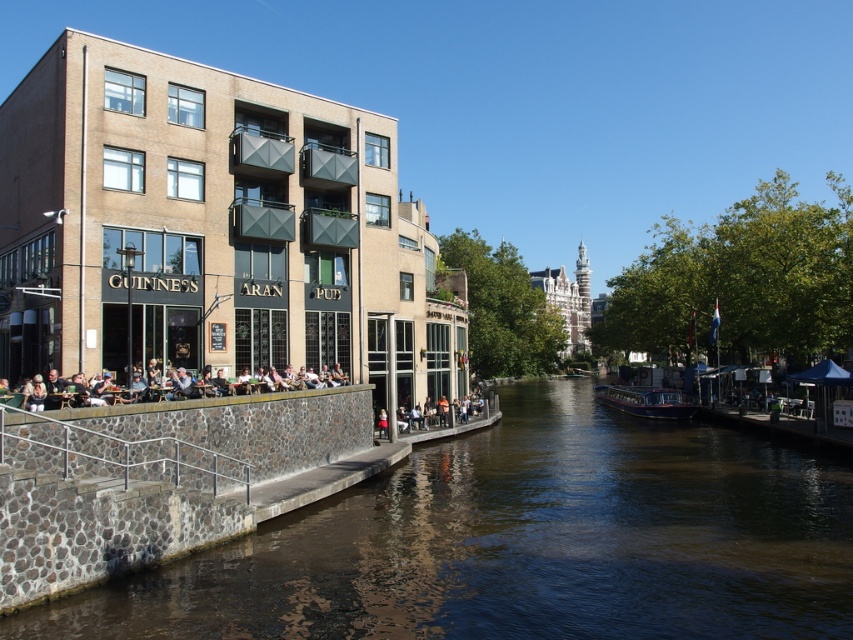
Question: From the image, what is the correct spatial relationship of matte black chairs at left in relation to dark blue polished wood boat at center?

Choices:
 (A) above
 (B) below

Answer: (A)

Question: Among these objects, which one is nearest to the camera?

Choices:
 (A) matte black chairs at left
 (B) dark blue polished wood boat at center
 (C) stainless steel railing at lower left
 (D) brown stone river at center

Answer: (D)

Question: Can you confirm if brown stone river at center is positioned below matte black chairs at left?

Choices:
 (A) yes
 (B) no

Answer: (A)

Question: Among these objects, which one is nearest to the camera?

Choices:
 (A) dark blue polished wood boat at center
 (B) stainless steel railing at lower left
 (C) matte black chairs at left

Answer: (B)

Question: Which of these objects is positioned closest to the matte black chairs at left?

Choices:
 (A) brown stone river at center
 (B) dark blue polished wood boat at center

Answer: (A)

Question: Can you confirm if stainless steel railing at lower left is thinner than dark blue polished wood boat at center?

Choices:
 (A) yes
 (B) no

Answer: (A)